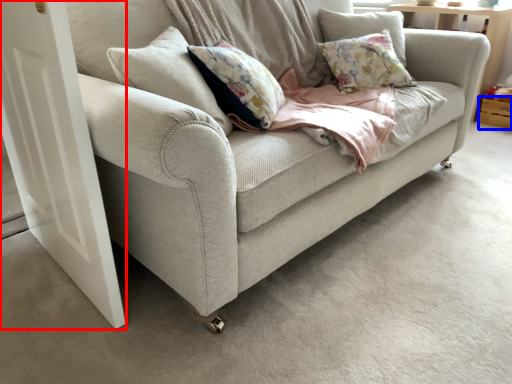
Question: Which of the following is the farthest to the observer, screen door (highlighted by a red box) or drawer (highlighted by a blue box)?

Choices:
 (A) screen door
 (B) drawer

Answer: (B)